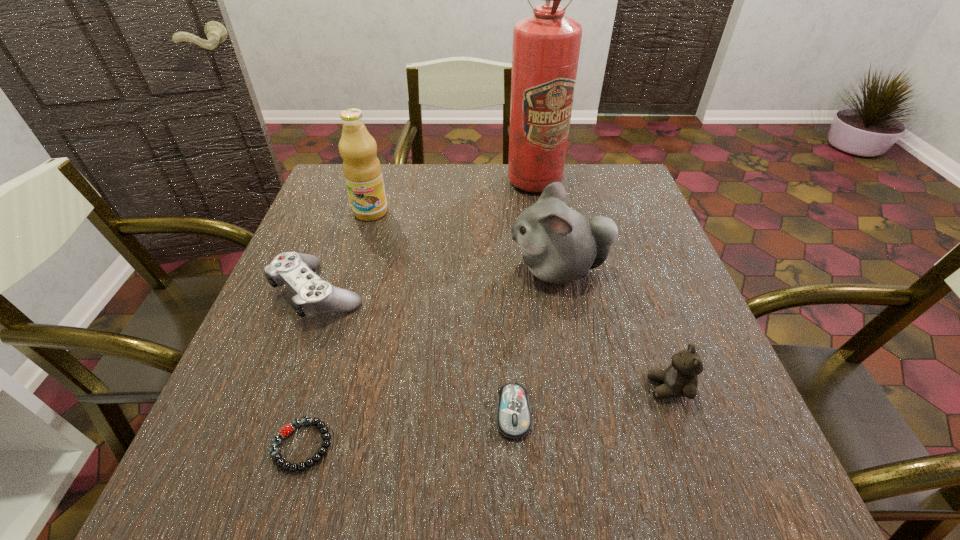
At what (x,y) coordinates should I click in order to perform the action: click on the tallest object. Please return your answer as a coordinate pair (x, y). The height and width of the screenshot is (540, 960). Looking at the image, I should click on (546, 45).

At what (x,y) coordinates should I click in order to perform the action: click on the farthest object. Please return your answer as a coordinate pair (x, y). Image resolution: width=960 pixels, height=540 pixels. Looking at the image, I should click on (546, 45).

Image resolution: width=960 pixels, height=540 pixels. Find the location of `the sixth nearest object`. the sixth nearest object is located at coordinates (362, 170).

In order to click on olive oil in this screenshot , I will do `click(362, 170)`.

Where is `the fifth shortest object`? Image resolution: width=960 pixels, height=540 pixels. the fifth shortest object is located at coordinates (559, 245).

You are a GUI agent. You are given a task and a screenshot of the screen. Output one action in this format:
    pyautogui.click(x=<x>, y=<y>)
    Task: Click on the rightmost object
    The height and width of the screenshot is (540, 960).
    Given the screenshot: What is the action you would take?
    pyautogui.click(x=680, y=379)

Identify the location of teddy bear. The height and width of the screenshot is (540, 960). (680, 379).

Identify the location of the fifth tallest object. The image size is (960, 540). (313, 296).

Find the location of `the sixth tallest object`. the sixth tallest object is located at coordinates (513, 415).

Find the location of a particular element. This screenshot has width=960, height=540. the shortest object is located at coordinates (324, 430).